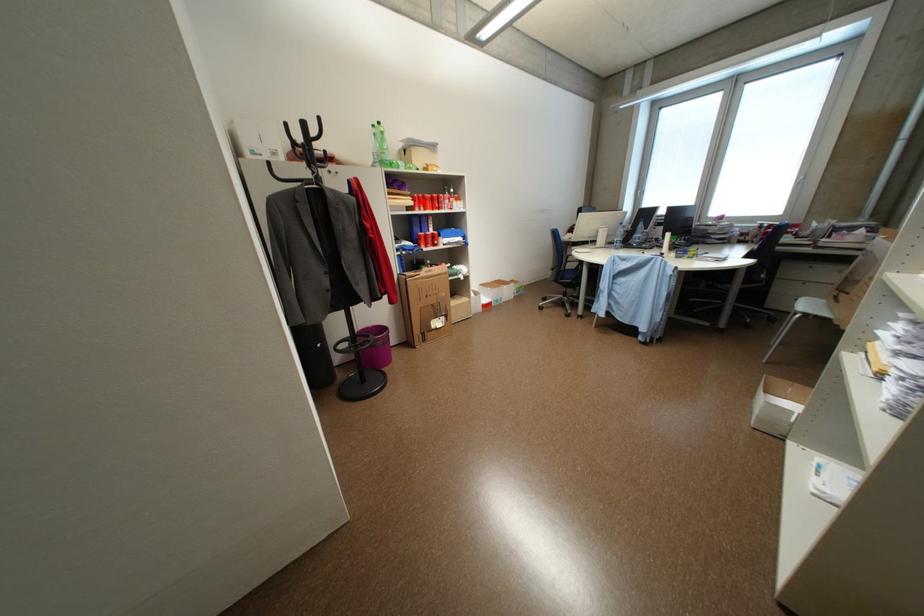
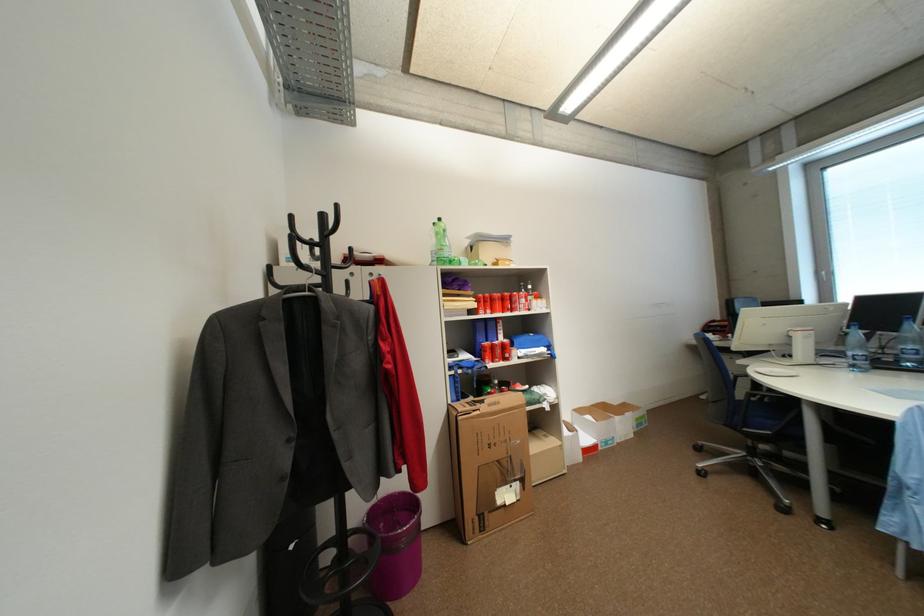
In the second image, find the point that corresponds to the highlighted location in the first image.

(485, 302)